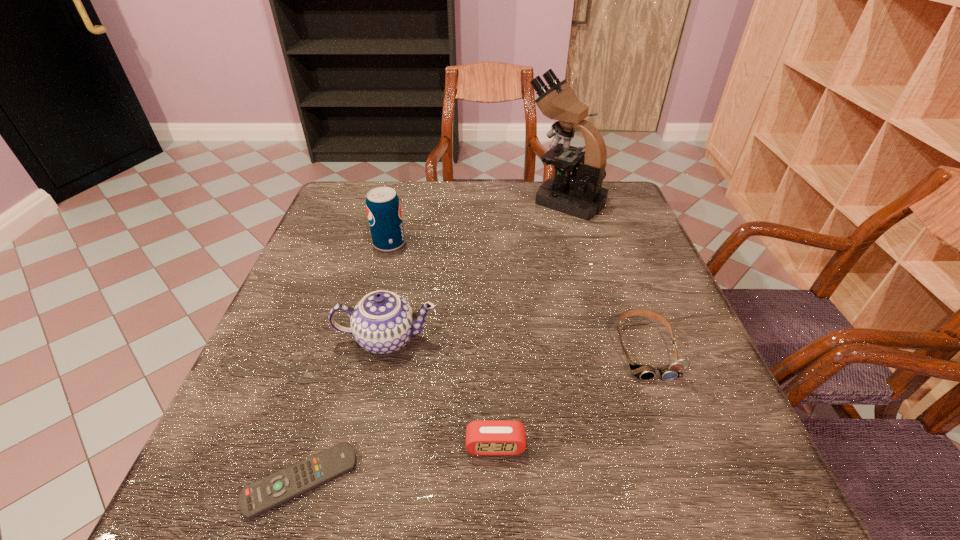
Where is `the tallest object`? This screenshot has height=540, width=960. the tallest object is located at coordinates (580, 194).

You are a GUI agent. You are given a task and a screenshot of the screen. Output one action in this format:
    pyautogui.click(x=<x>, y=<y>)
    Task: Click on the microscope
    The height and width of the screenshot is (540, 960).
    Given the screenshot: What is the action you would take?
    pyautogui.click(x=580, y=194)

Find the location of a particular element. the second farthest object is located at coordinates (383, 207).

This screenshot has width=960, height=540. Identify the location of the fifth shortest object. (383, 207).

The image size is (960, 540). Identify the location of chinaware. (383, 322).

Where is `goggles`? goggles is located at coordinates (643, 372).

Where is `the fourth object from left to right`? The width and height of the screenshot is (960, 540). the fourth object from left to right is located at coordinates (485, 437).

At what (x,y) coordinates should I click in order to perform the action: click on the shortest object. Please return your answer as a coordinate pair (x, y). This screenshot has width=960, height=540. Looking at the image, I should click on (256, 498).

Locate an element on the screen. This screenshot has height=540, width=960. vacant space located on the left of the tallest object is located at coordinates (466, 200).

Locate an element on the screen. vacant space located on the right of the fifth shortest object is located at coordinates (544, 244).